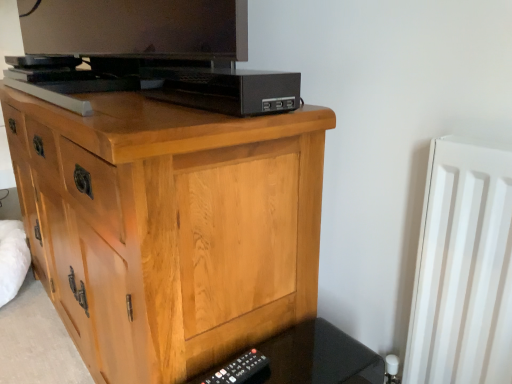
Question: Relative to black plastic remote at lower right, is black plastic remote at lower right in front or behind?

Choices:
 (A) behind
 (B) front

Answer: (A)

Question: Would you say black plastic remote at lower right is to the left or to the right of black plastic remote at lower right in the picture?

Choices:
 (A) right
 (B) left

Answer: (B)

Question: Considering the real-world distances, which object is farthest from the light wood chest of drawers at center?

Choices:
 (A) black plastic remote at lower right
 (B) black plastic remote at lower right
 (C) black plastic usb hub at upper center

Answer: (A)

Question: Which of these objects is positioned farthest from the black plastic remote at lower right?

Choices:
 (A) black plastic remote at lower right
 (B) black plastic usb hub at upper center
 (C) light wood chest of drawers at center

Answer: (B)